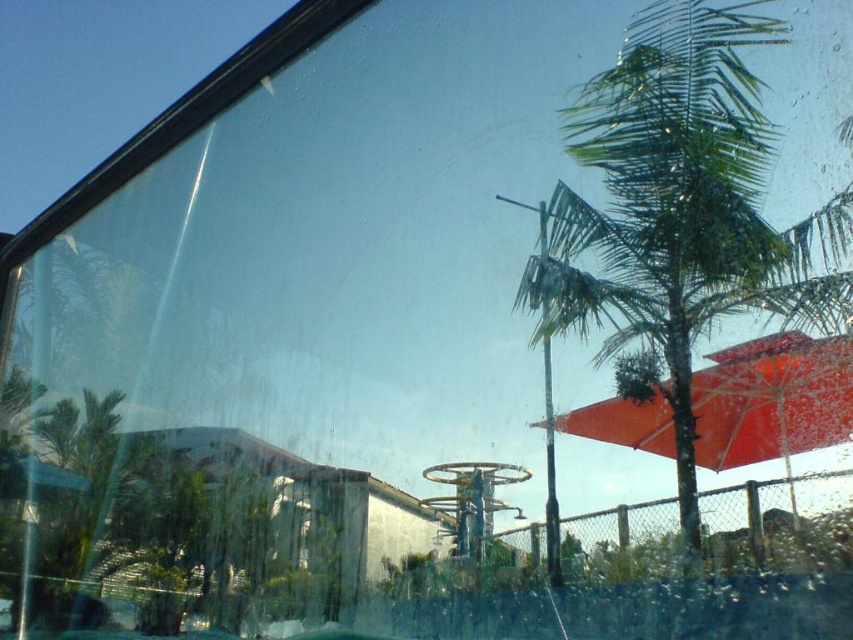
Does green leafy palm tree at right have a lesser width compared to matte red umbrella at center right?

No, green leafy palm tree at right is not thinner than matte red umbrella at center right.

Between point (645, 104) and point (724, 387), which one is positioned in front?

Point (645, 104)

What are the coordinates of `green leafy palm tree at right` in the screenshot? It's located at [x=665, y=205].